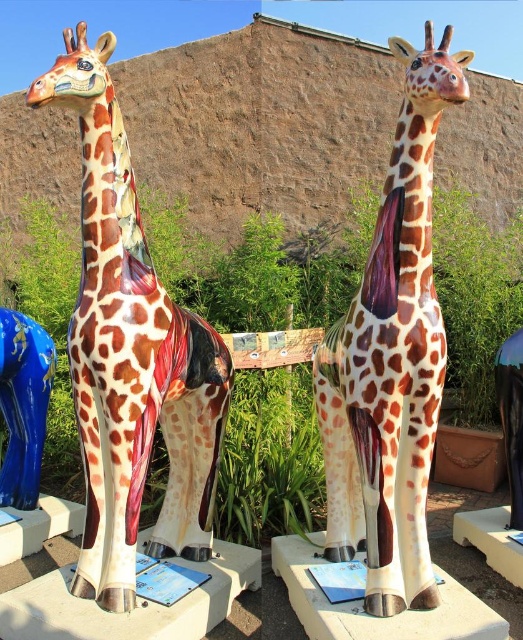
Question: Does polished ceramic giraffe at left have a greater width compared to blue glossy sign at center?

Choices:
 (A) yes
 (B) no

Answer: (A)

Question: Can you confirm if glossy ceramic giraffe at center is positioned above blue glossy vase at lower left?

Choices:
 (A) yes
 (B) no

Answer: (A)

Question: Which point appears farthest from the camera in this image?

Choices:
 (A) (381, 234)
 (B) (174, 579)

Answer: (B)

Question: Which point is farther to the camera?

Choices:
 (A) (130, 476)
 (B) (404, 563)

Answer: (B)

Question: Which object appears farthest from the camera in this image?

Choices:
 (A) polished ceramic giraffe at left
 (B) blue glossy vase at lower left

Answer: (B)

Question: Observing the image, what is the correct spatial positioning of polished ceramic giraffe at left in reference to glossy ceramic giraffe at center?

Choices:
 (A) below
 (B) above

Answer: (A)